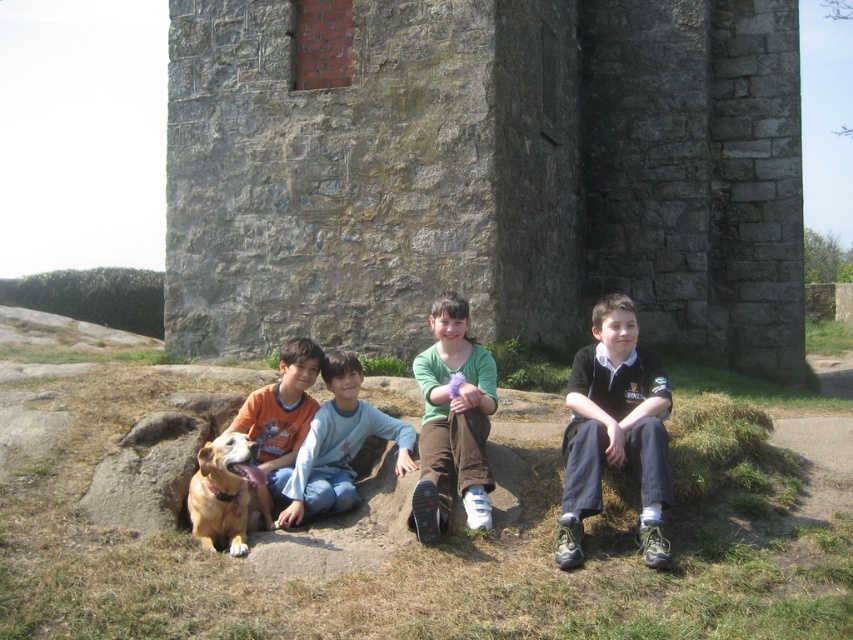
Which is below, stone wall at center or dark blue uniform at center?

dark blue uniform at center is below.

Who is positioned more to the right, stone wall at center or dark blue uniform at center?

stone wall at center is more to the right.

Is point (381, 128) less distant than point (654, 397)?

No.

You are a GUI agent. You are given a task and a screenshot of the screen. Output one action in this format:
    pyautogui.click(x=<x>, y=<y>)
    Task: Click on the stone wall at center
    
    Given the screenshot: What is the action you would take?
    pyautogui.click(x=488, y=173)

Can you confirm if dark blue uniform at center is smaller than light blue cotton shirt at center?

No, dark blue uniform at center is not smaller than light blue cotton shirt at center.

Between point (605, 397) and point (341, 356), which one is positioned in front?

Point (605, 397) is more forward.

The width and height of the screenshot is (853, 640). Find the location of `dark blue uniform at center`. dark blue uniform at center is located at coordinates (x=614, y=432).

Does green matte shirt at center have a larger size compared to light blue cotton shirt at center?

Yes.

Does green matte shirt at center appear under light blue cotton shirt at center?

No, green matte shirt at center is not below light blue cotton shirt at center.

Who is more forward, (461, 307) or (344, 492)?

→ Point (344, 492) is more forward.

Where is `green matte shirt at center`? This screenshot has height=640, width=853. green matte shirt at center is located at coordinates (451, 422).